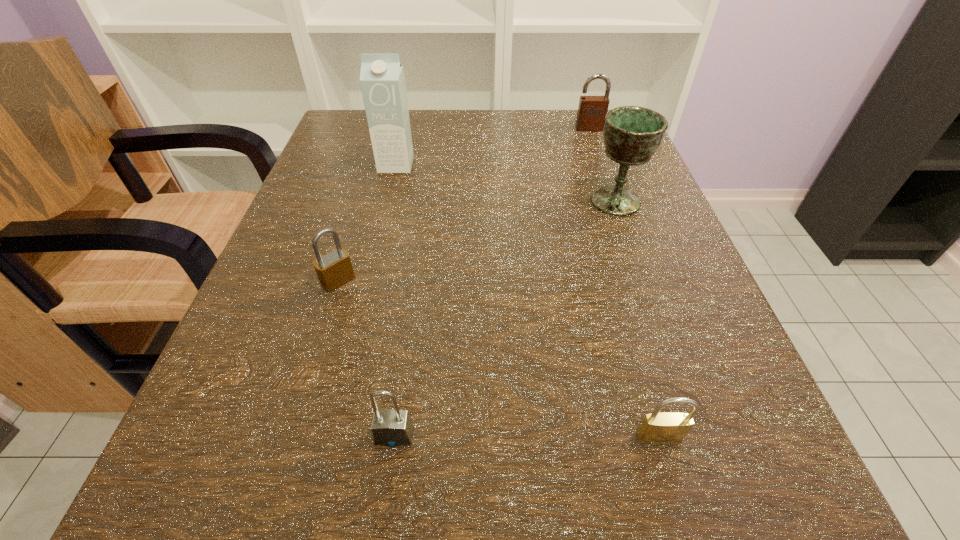
I want to click on vacant space that is in between the fifth shortest object and the carton, so click(506, 183).

The width and height of the screenshot is (960, 540). Find the location of `free space that is in between the second padlock from left to right and the fifth shortest object`. free space that is in between the second padlock from left to right and the fifth shortest object is located at coordinates (505, 318).

In order to click on free point between the third nearest padlock and the tallest object in this screenshot , I will do `click(367, 222)`.

Choose which object is the fourth nearest neighbor to the tallest object. Please provide its 2D coordinates. Your answer should be formatted as a tuple, i.e. [(x, y)], where the tuple contains the x and y coordinates of a point satisfying the conditions above.

[(391, 427)]

Identify which object is the third closest to the third tallest object. Please provide its 2D coordinates. Your answer should be formatted as a tuple, i.e. [(x, y)], where the tuple contains the x and y coordinates of a point satisfying the conditions above.

[(333, 269)]

Find the location of a particular element. padlock that is the fourth closest to the second tallest object is located at coordinates (391, 427).

The width and height of the screenshot is (960, 540). Find the location of `the second closest padlock to the tallest object`. the second closest padlock to the tallest object is located at coordinates (592, 110).

Where is `vacant space that satisfies the following two spatial constraints: 1. on the front-facing side of the tallest padlock; 2. on the left side of the chalice`? The height and width of the screenshot is (540, 960). vacant space that satisfies the following two spatial constraints: 1. on the front-facing side of the tallest padlock; 2. on the left side of the chalice is located at coordinates (614, 201).

Where is `blank area in the image that satisfies the following two spatial constraints: 1. on the front-facing side of the chalice; 2. on the left side of the fourth shortest object`? blank area in the image that satisfies the following two spatial constraints: 1. on the front-facing side of the chalice; 2. on the left side of the fourth shortest object is located at coordinates (614, 201).

Find the location of a particular element. The image size is (960, 540). free spot that satisfies the following two spatial constraints: 1. on the front label of the second farthest object; 2. on the right side of the fifth shortest object is located at coordinates (387, 201).